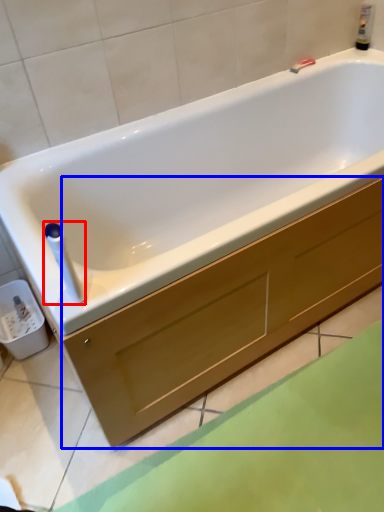
Question: Which object appears closest to the camera in this image, towel bar (highlighted by a red box) or drawer (highlighted by a blue box)?

Choices:
 (A) towel bar
 (B) drawer

Answer: (B)